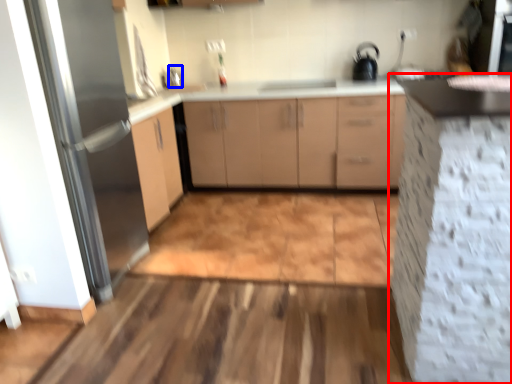
Question: Among these objects, which one is nearest to the camera, cabinetry (highlighted by a red box) or faucet (highlighted by a blue box)?

Choices:
 (A) cabinetry
 (B) faucet

Answer: (A)